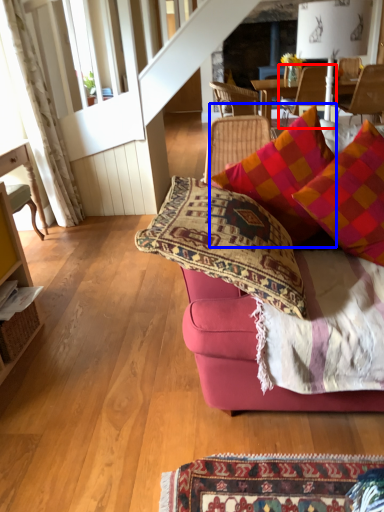
Question: Which point is further to the camera, chair (highlighted by a red box) or pillow (highlighted by a blue box)?

Choices:
 (A) chair
 (B) pillow

Answer: (A)